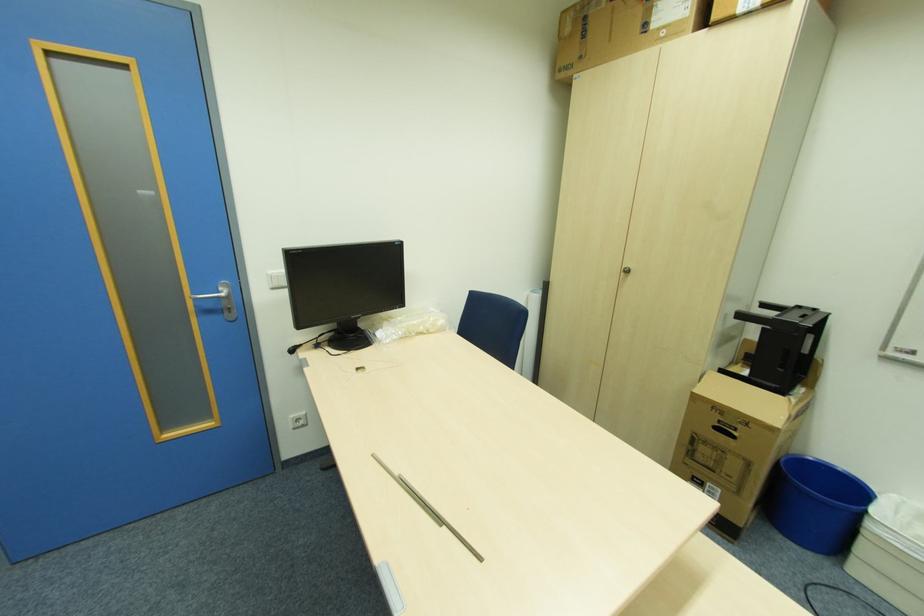
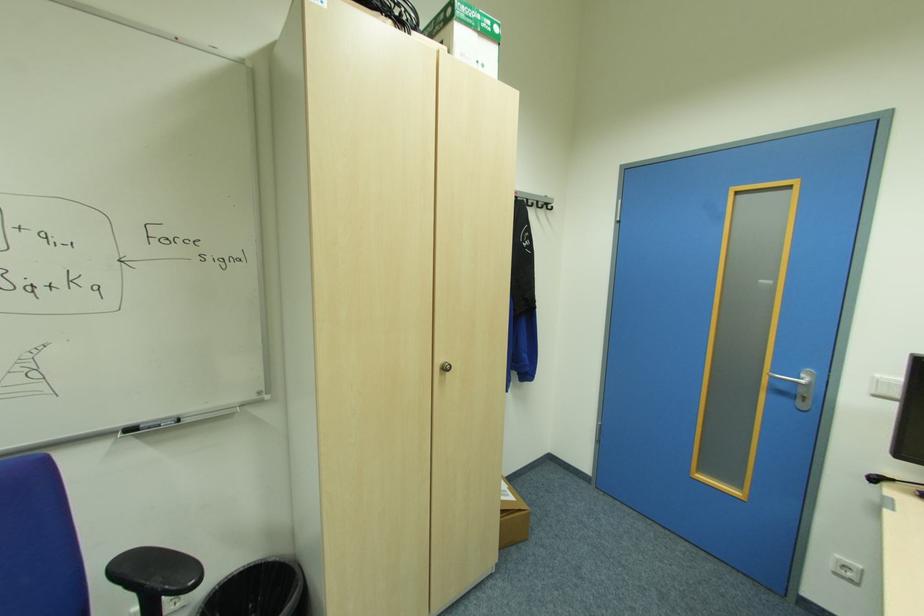
Question: How did the camera likely rotate?

Choices:
 (A) Left
 (B) Right
 (C) Up
 (D) Down

Answer: (A)